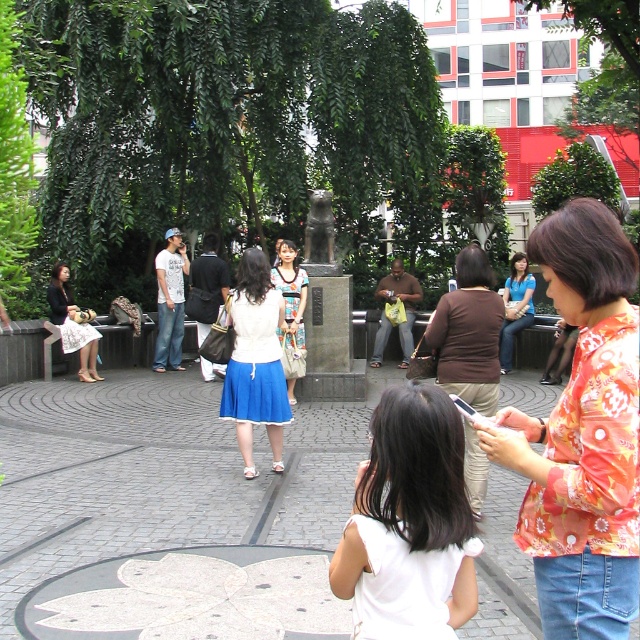
Is white lace dress at center wider than bronze statue at center?

Indeed, white lace dress at center has a greater width compared to bronze statue at center.

Can you confirm if white lace dress at center is bigger than bronze statue at center?

Yes.

Between point (68, 269) and point (330, 253), which one is positioned behind?

Point (68, 269)

Locate an element on the screen. Image resolution: width=640 pixels, height=640 pixels. white lace dress at center is located at coordinates (72, 323).

Can you confirm if white fabric dress at center is positioned below white cotton dress at center?

Yes, white fabric dress at center is below white cotton dress at center.

Who is taller, white fabric dress at center or white cotton dress at center?

Standing taller between the two is white cotton dress at center.

Does point (417, 416) lie behind point (289, 305)?

No, (417, 416) is in front of (289, 305).

The width and height of the screenshot is (640, 640). Find the location of `white fabric dress at center`. white fabric dress at center is located at coordinates (410, 522).

Can you confirm if brown fabric skirt at center is positioned to the left of bronze statue at center?

No, brown fabric skirt at center is not to the left of bronze statue at center.

Who is higher up, brown fabric skirt at center or bronze statue at center?

Positioned higher is bronze statue at center.

The image size is (640, 640). What are the coordinates of `brown fabric skirt at center` in the screenshot? It's located at (468, 333).

Locate an element on the screen. brown fabric skirt at center is located at coordinates (468, 333).